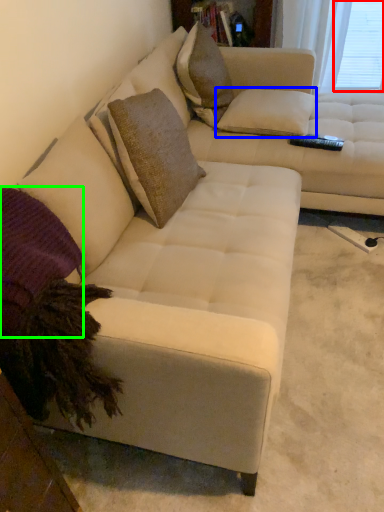
Question: Considering the real-world distances, which object is farthest from window screen (highlighted by a red box)? pillow (highlighted by a blue box) or pillow (highlighted by a green box)?

Choices:
 (A) pillow
 (B) pillow

Answer: (B)